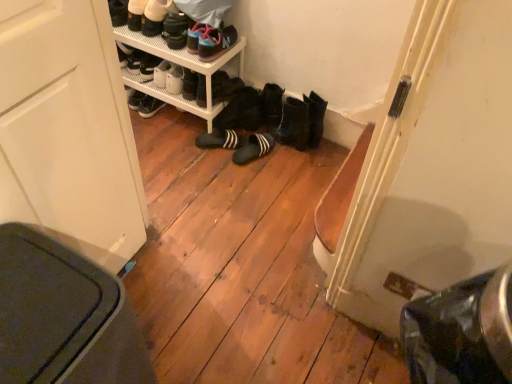
The height and width of the screenshot is (384, 512). Find the location of `vacant area in front of black suede slippers at center, placed as the 1th footwear when sorted from bottom to top`. vacant area in front of black suede slippers at center, placed as the 1th footwear when sorted from bottom to top is located at coordinates (248, 170).